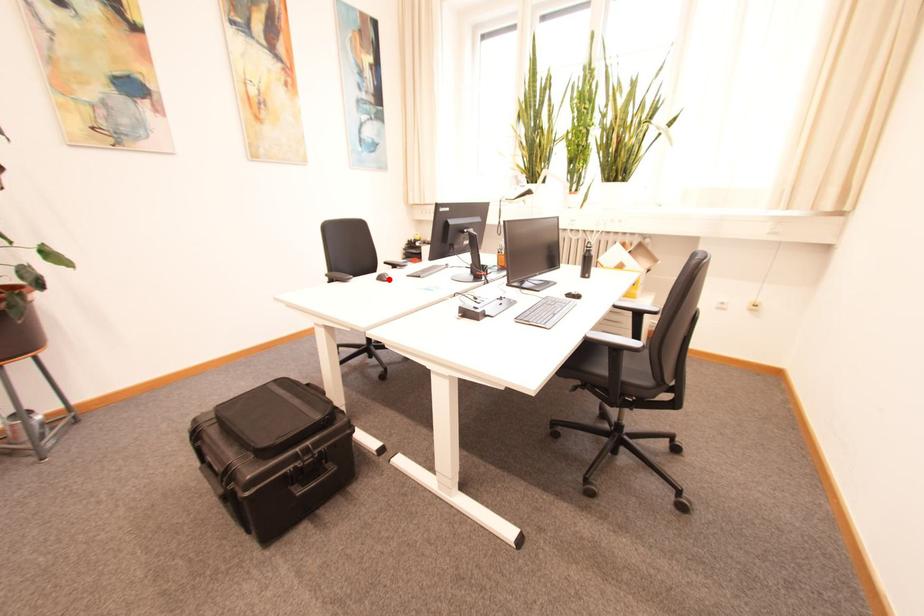
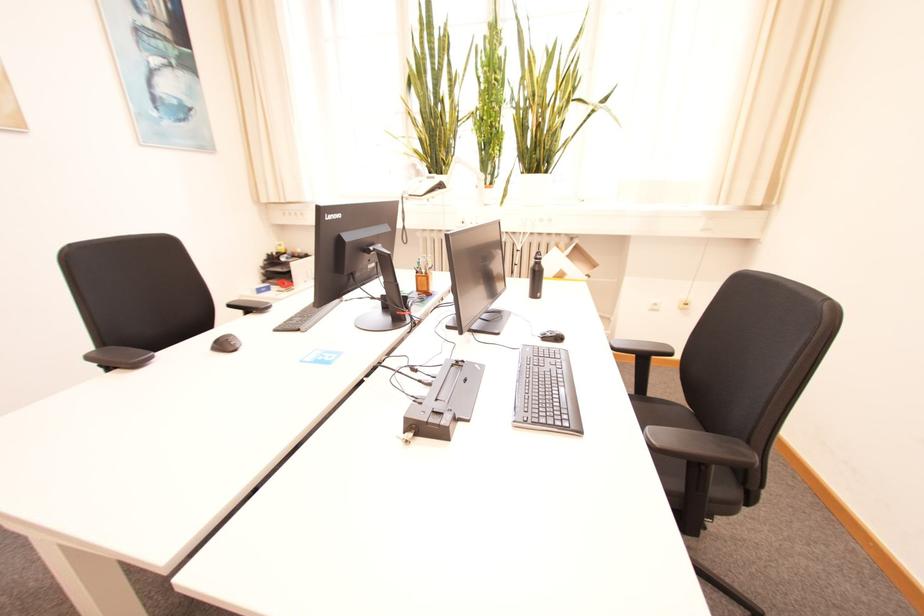
Find the pixel in the second image that matches the highlighted location in the first image.

(229, 346)